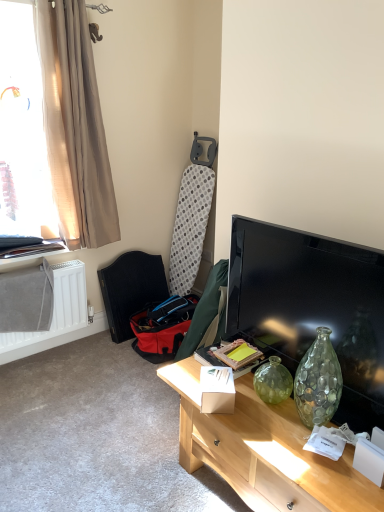
Question: Considering the positions of light wood desk at center and dark brown leather armchair at lower left in the image, is light wood desk at center bigger or smaller than dark brown leather armchair at lower left?

Choices:
 (A) big
 (B) small

Answer: (A)

Question: Considering the positions of light wood desk at center and dark brown leather armchair at lower left in the image, is light wood desk at center taller or shorter than dark brown leather armchair at lower left?

Choices:
 (A) short
 (B) tall

Answer: (A)

Question: Considering the real-world distances, which object is closest to the translucent beige curtain at upper left?

Choices:
 (A) beige fabric curtain at left
 (B) white cardboard box at center
 (C) matte black tv at right
 (D) white matte radiator at lower left
 (E) dark brown leather armchair at lower left

Answer: (A)

Question: Estimate the real-world distances between objects in this image. Which object is closer to the light wood desk at center?

Choices:
 (A) beige fabric curtain at left
 (B) translucent beige curtain at upper left
 (C) dark brown leather armchair at lower left
 (D) white cardboard box at center
 (E) white matte radiator at lower left

Answer: (D)